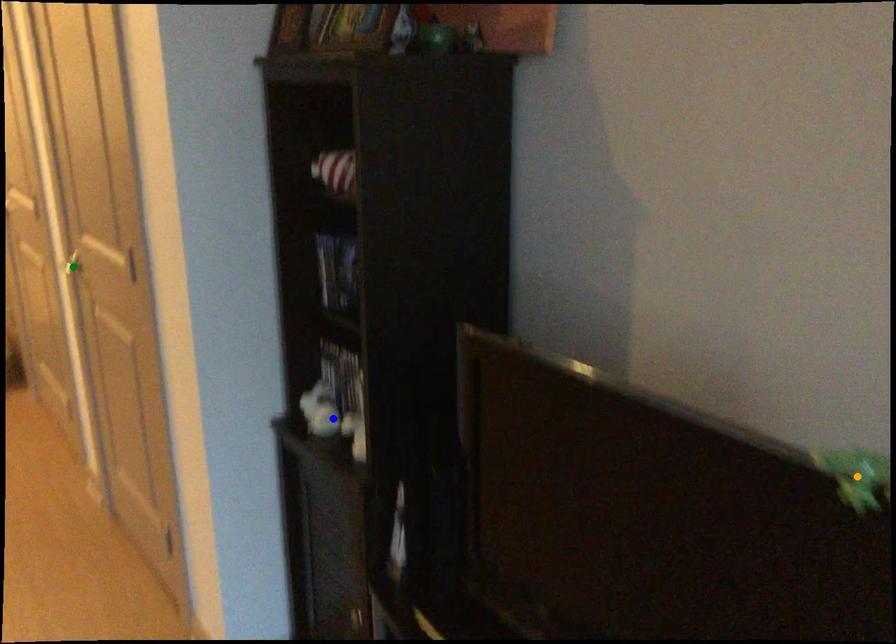
Order these from nearest to farthest:
A) orange point
B) blue point
C) green point

orange point < blue point < green point